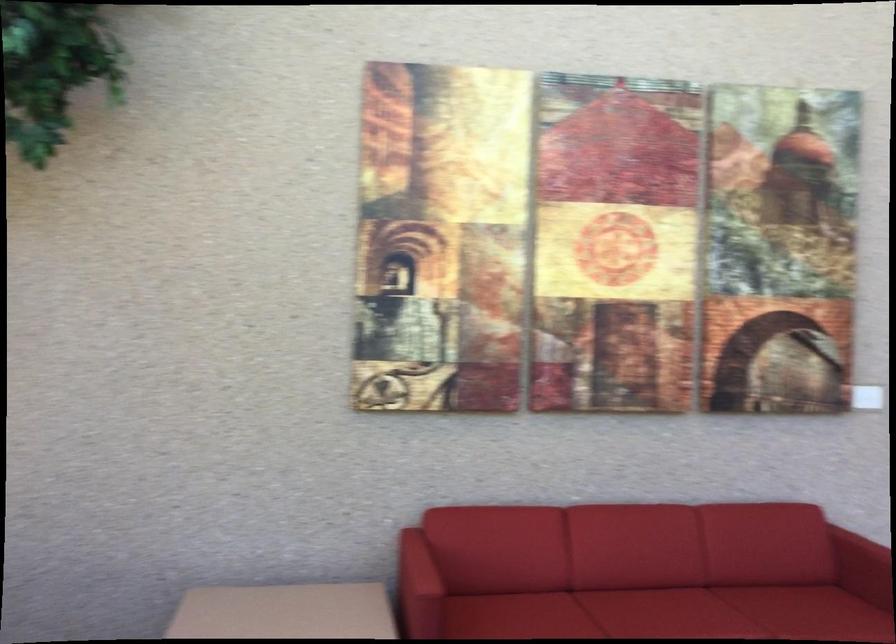
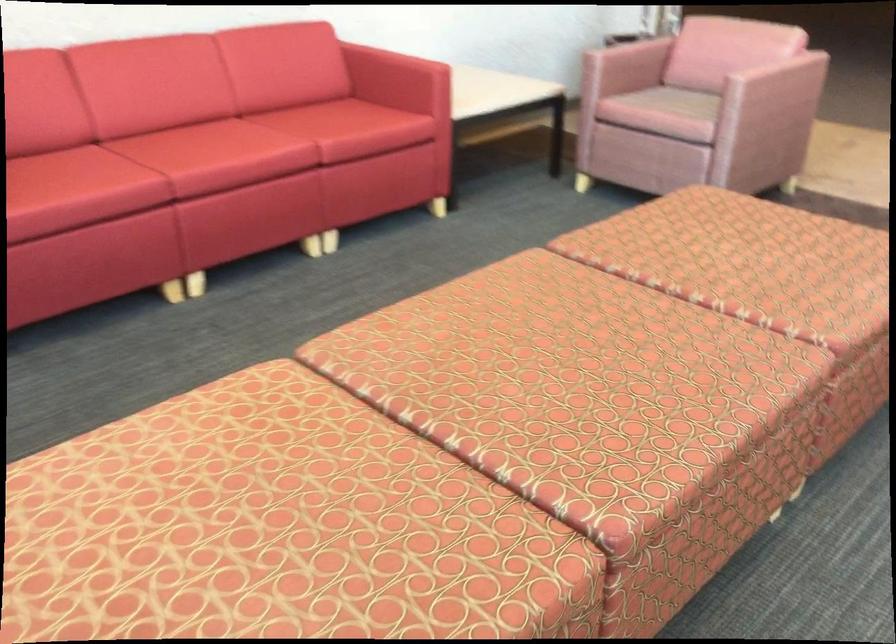
Based on the continuous images, in which direction is the camera rotating?

The rotation direction of the camera is right-down.